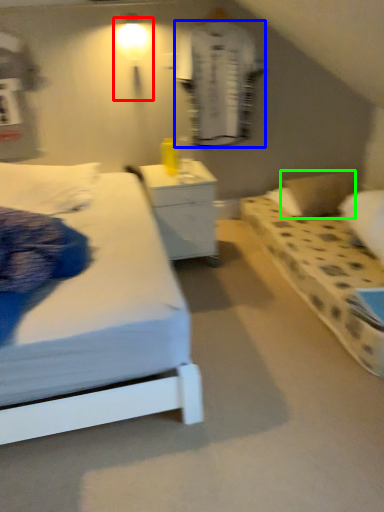
Question: Considering the real-world distances, which object is closest to light fixture (highlighted by a red box)? robe (highlighted by a blue box) or pillow (highlighted by a green box).

Choices:
 (A) robe
 (B) pillow

Answer: (A)